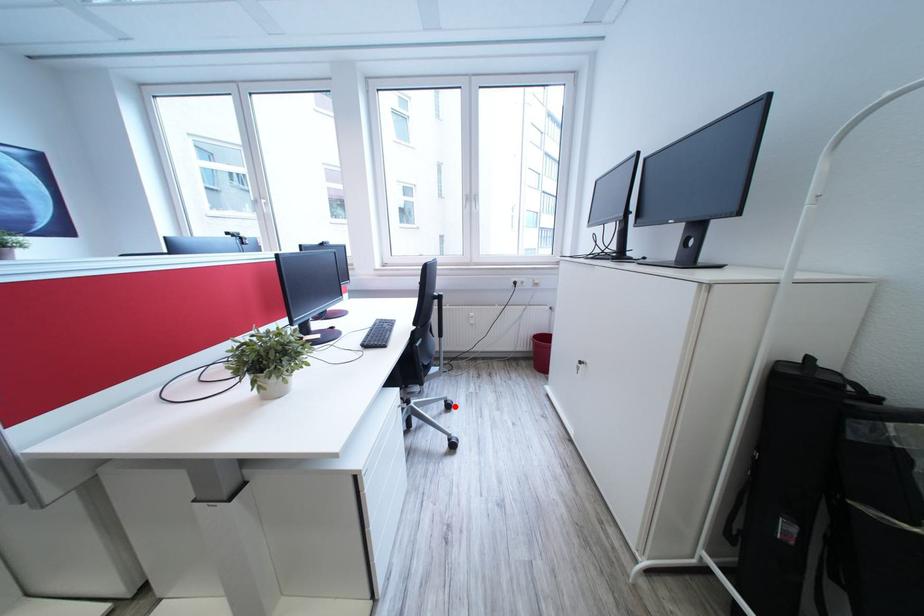
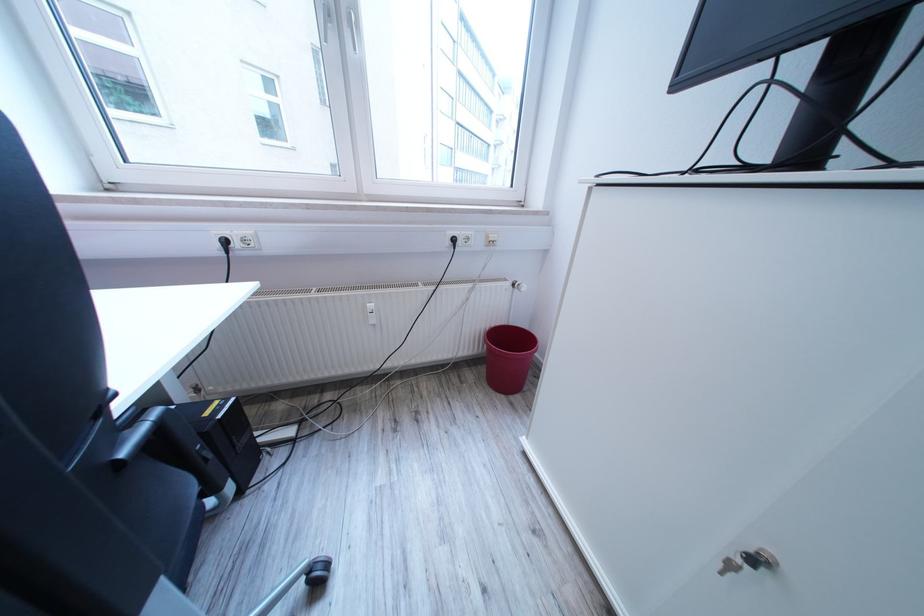
Find the pixel in the second image that matches the highlighted location in the first image.

(315, 580)